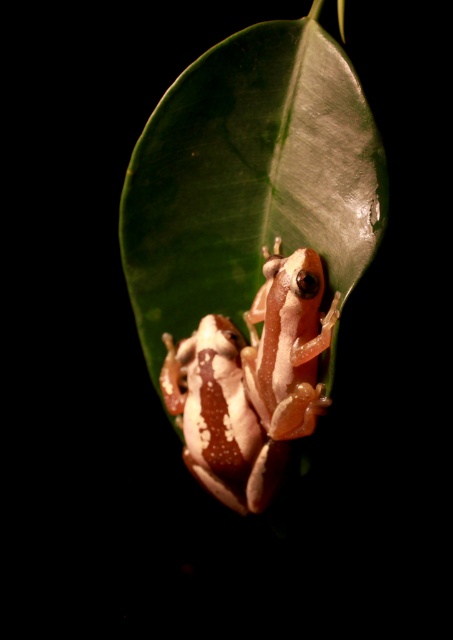
You are a GUI agent. You are given a task and a screenshot of the screen. Output one action in this format:
    pyautogui.click(x=<x>, y=<y>)
    Task: Click on the green glossy leaf at center
    This screenshot has height=640, width=453.
    Given the screenshot: What is the action you would take?
    pyautogui.click(x=249, y=179)

Can you confirm if green glossy leaf at center is positioned to the right of speckled white frog at center?

Correct, you'll find green glossy leaf at center to the right of speckled white frog at center.

Does point (258, 198) come in front of point (230, 486)?

Yes, it is in front of point (230, 486).

You are a GUI agent. You are given a task and a screenshot of the screen. Output one action in this format:
    pyautogui.click(x=<x>, y=<y>)
    Task: Click on the green glossy leaf at center
    
    Given the screenshot: What is the action you would take?
    pyautogui.click(x=249, y=179)

Is green glossy leaf at center shorter than translucent skin frog at center?

No.

Find the location of `green glossy leaf at center`. green glossy leaf at center is located at coordinates (249, 179).

Locate an element on the screen. The image size is (453, 640). green glossy leaf at center is located at coordinates (249, 179).

Who is more forward, (319, 412) or (205, 358)?

Point (319, 412) is in front.

Is translucent skin frog at center wider than speckled white frog at center?

Incorrect, translucent skin frog at center's width does not surpass speckled white frog at center's.

Is point (284, 344) closer to viewer compared to point (231, 472)?

Yes, point (284, 344) is in front of point (231, 472).

Where is `translucent skin frog at center`? The image size is (453, 640). translucent skin frog at center is located at coordinates (288, 342).